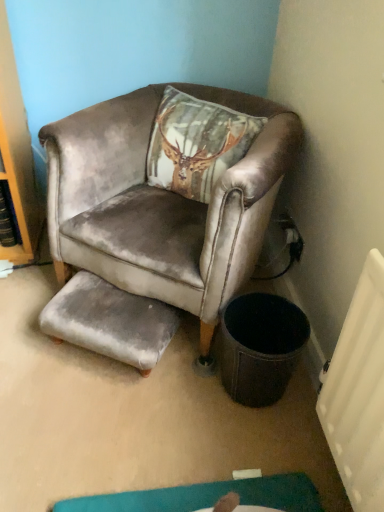
Locate an element on the screen. The image size is (384, 512). vacant space in front of gray velvet footrest at lower center is located at coordinates (103, 420).